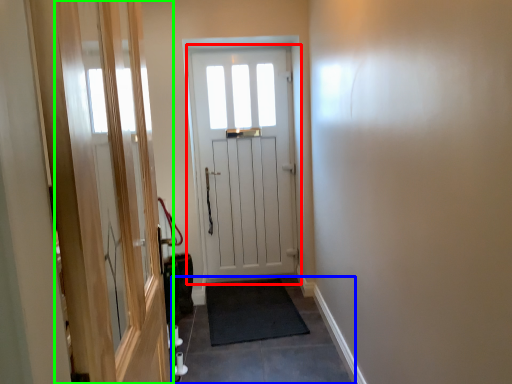
Question: Considering the real-world distances, which object is farthest from door (highlighted by a red box)? path (highlighted by a blue box) or screen door (highlighted by a green box)?

Choices:
 (A) path
 (B) screen door

Answer: (B)